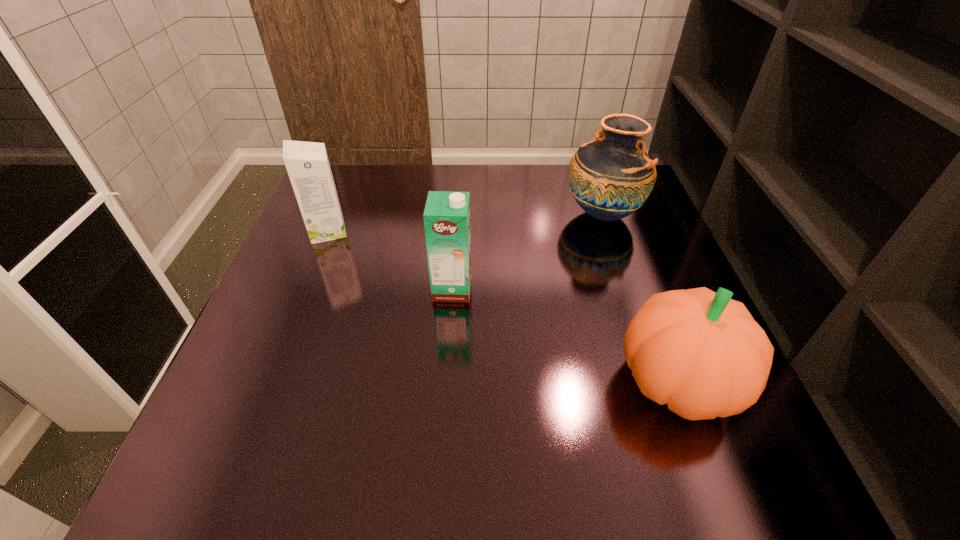
Identify the location of vacant space at the right edge of the desktop. (663, 276).

Where is `blank space at the near right corner`? The image size is (960, 540). blank space at the near right corner is located at coordinates (x=696, y=436).

You are a GUI agent. You are given a task and a screenshot of the screen. Output one action in this format:
    pyautogui.click(x=<x>, y=<y>)
    Task: Click on the vacant space in between the third object from right to left and the pumpkin
    This screenshot has height=540, width=960.
    Given the screenshot: What is the action you would take?
    pyautogui.click(x=565, y=335)

At what (x,y) coordinates should I click in order to perform the action: click on unoccupied position between the right carton and the pumpkin. Please return your answer as a coordinate pair (x, y). The width and height of the screenshot is (960, 540). Looking at the image, I should click on (565, 335).

Locate an element on the screen. vacant region between the left carton and the nearer carton is located at coordinates (390, 260).

This screenshot has width=960, height=540. In order to click on free space between the second object from left to right and the pumpkin in this screenshot , I will do `click(565, 335)`.

The image size is (960, 540). In order to click on free point between the pumpkin and the pottery in this screenshot , I will do `click(640, 298)`.

In order to click on free space that is in between the pumpkin and the pottery in this screenshot , I will do pyautogui.click(x=640, y=298).

Identify the location of free space that is in between the right carton and the nearest object. Image resolution: width=960 pixels, height=540 pixels. (565, 335).

Where is `empty space that is in between the right carton and the pottery`? The width and height of the screenshot is (960, 540). empty space that is in between the right carton and the pottery is located at coordinates (527, 252).